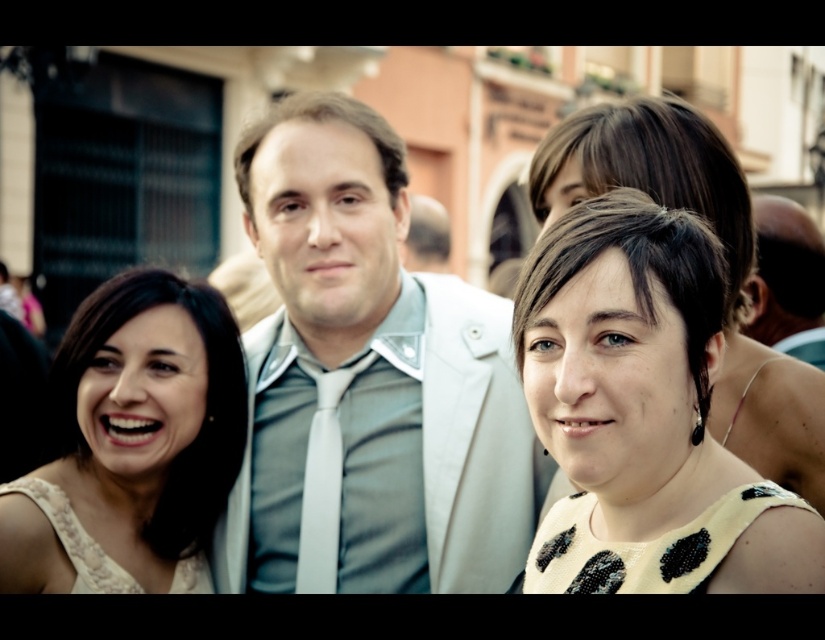
Question: Which object is positioned closest to the white silk tie at center?

Choices:
 (A) light gray fabric suit at center
 (B) yellow dotted dress at center
 (C) matte beige dress at center
 (D) matte white suit at center

Answer: (A)

Question: Among these points, which one is nearest to the camera?

Choices:
 (A) (8, 576)
 (B) (715, 525)

Answer: (B)

Question: Can you confirm if light gray fabric suit at center is smaller than matte white suit at center?

Choices:
 (A) no
 (B) yes

Answer: (A)

Question: Can you confirm if light gray fabric suit at center is smaller than white silk tie at center?

Choices:
 (A) no
 (B) yes

Answer: (A)

Question: Is matte white suit at center wider than white silk tie at center?

Choices:
 (A) yes
 (B) no

Answer: (A)

Question: Which of the following is the closest to the observer?

Choices:
 (A) (338, 390)
 (B) (534, 333)
 (C) (159, 413)
 (D) (771, 333)

Answer: (B)